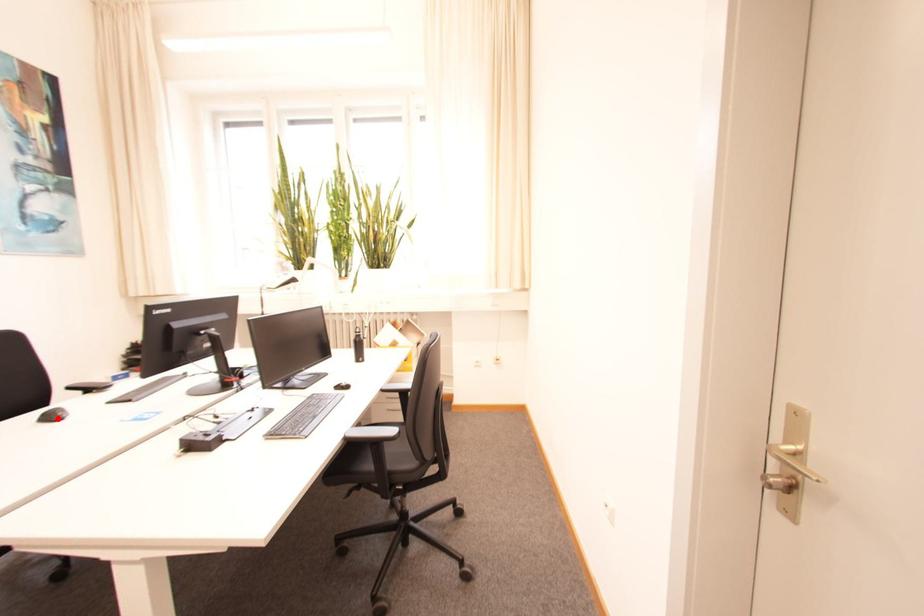
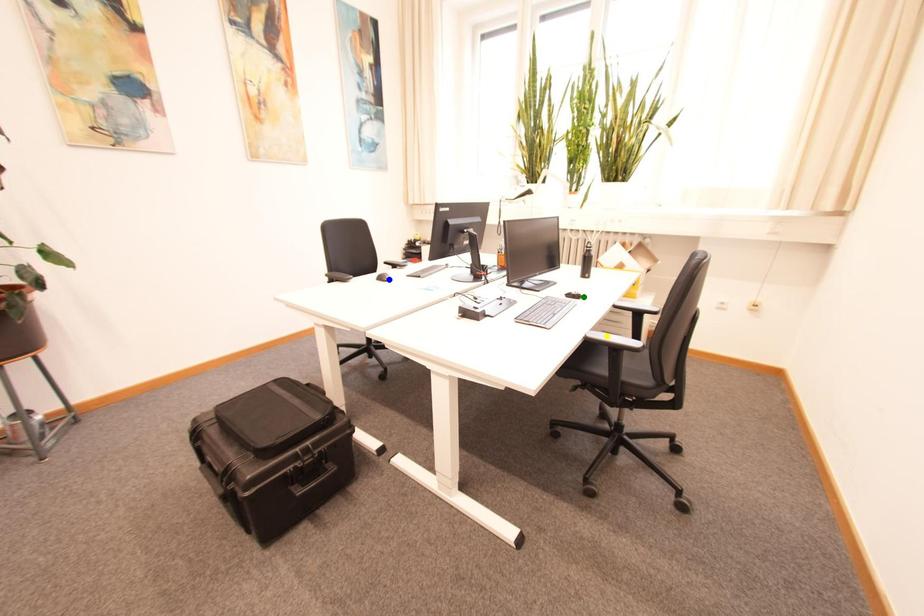
Question: I am providing you with two images of the same scene from different viewpoints. A red point is marked on the first image. You are given multiple points on the second image. Which point in image 2 represents the same 3d spot as the red point in image 1?

Choices:
 (A) blue point
 (B) yellow point
 (C) green point

Answer: (A)